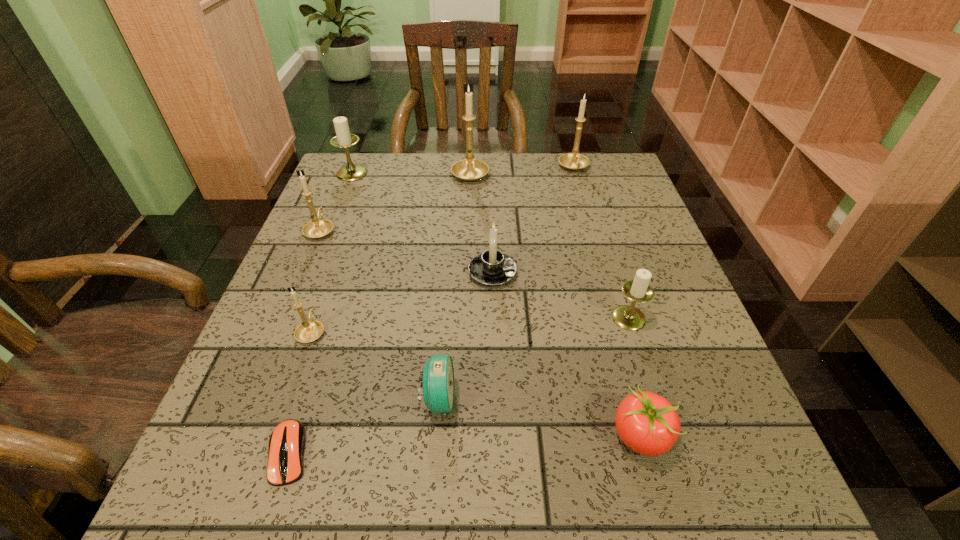
This screenshot has height=540, width=960. I want to click on the biggest gold candle holder, so click(x=469, y=169).

Find the location of `the tallest object`. the tallest object is located at coordinates (469, 169).

At what (x,y) coordinates should I click in order to perform the action: click on the rightmost gold candle holder. Please return your answer as a coordinate pair (x, y). The image size is (960, 540). Looking at the image, I should click on (573, 161).

Image resolution: width=960 pixels, height=540 pixels. Identify the location of the sixth shortest candle holder. (573, 161).

This screenshot has height=540, width=960. What are the coordinates of `the fourth nearest candle holder` in the screenshot? It's located at coord(317,228).

What are the coordinates of `the second smallest gold candle holder` in the screenshot? It's located at 317,228.

I want to click on the bigger white candle holder, so click(343, 139).

Where is `the farther white candle holder`? Image resolution: width=960 pixels, height=540 pixels. the farther white candle holder is located at coordinates (343, 139).

Find the location of a particular element. the fifth farthest candle holder is located at coordinates (491, 268).

The width and height of the screenshot is (960, 540). In order to click on the third gold candle holder from right to left in this screenshot , I will do `click(308, 331)`.